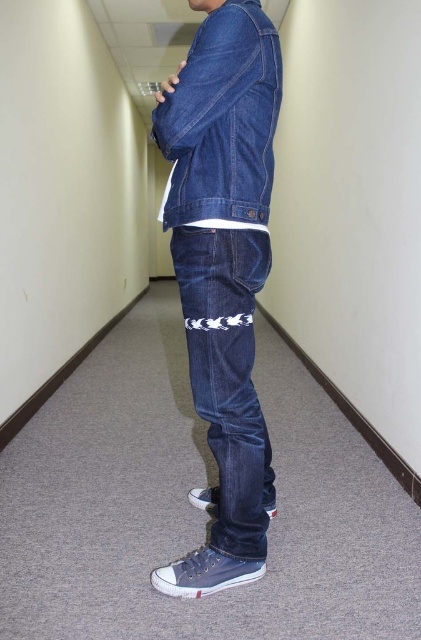
Question: Among these objects, which one is farthest from the camera?

Choices:
 (A) denim jacket at center
 (B) dark blue denim jeans at center

Answer: (B)

Question: Does dark blue denim jeans at center have a lesser width compared to denim jacket at center?

Choices:
 (A) no
 (B) yes

Answer: (B)

Question: Does denim jeans at center appear on the left side of dark blue denim jeans at center?

Choices:
 (A) no
 (B) yes

Answer: (B)

Question: Can you confirm if denim jeans at center is positioned to the left of denim jacket at center?

Choices:
 (A) no
 (B) yes

Answer: (B)

Question: Which point is closer to the camera?

Choices:
 (A) (199, 88)
 (B) (272, 81)
 (C) (232, 541)

Answer: (A)

Question: Which object is positioned closest to the denim jeans at center?

Choices:
 (A) dark blue denim jeans at center
 (B) denim jacket at center

Answer: (A)